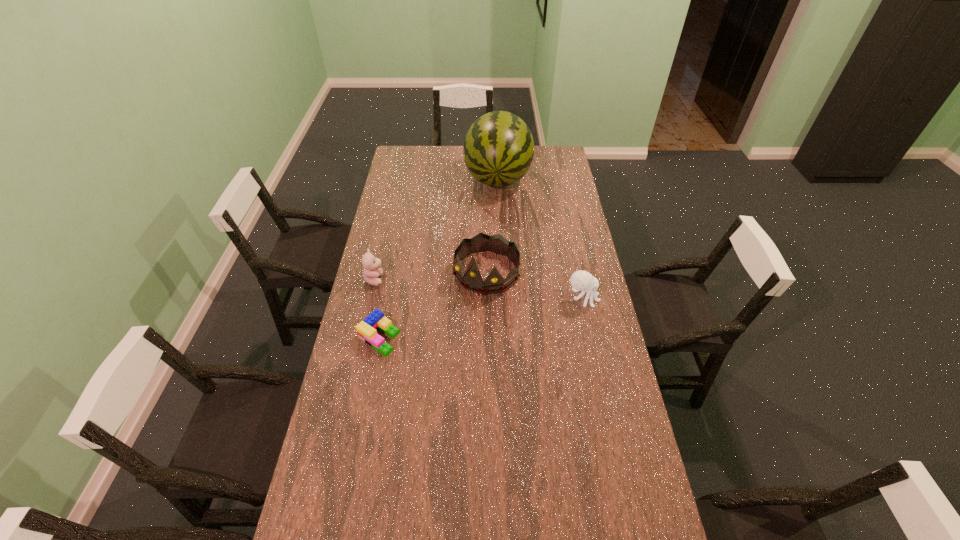
You are a GUI agent. You are given a task and a screenshot of the screen. Output one action in this format:
    pyautogui.click(x=<x>, y=<y>)
    Task: Click on the Lego
    
    Given the screenshot: What is the action you would take?
    click(367, 329)

The image size is (960, 540). I want to click on the nearest object, so click(x=367, y=329).

You are a GUI agent. You are given a task and a screenshot of the screen. Output one action in this format:
    pyautogui.click(x=<x>, y=<y>)
    Task: Click on the octopus
    This screenshot has height=540, width=960.
    Given the screenshot: What is the action you would take?
    pyautogui.click(x=583, y=281)

The image size is (960, 540). I want to click on the tallest object, so click(498, 150).

The height and width of the screenshot is (540, 960). Find the location of `the farthest object`. the farthest object is located at coordinates (498, 150).

In order to click on the second tallest object in this screenshot , I will do `click(472, 280)`.

In order to click on teddy bear in this screenshot , I will do `click(371, 272)`.

Locate an element on the screen. The width and height of the screenshot is (960, 540). vacant position located on the right of the nearest object is located at coordinates pyautogui.click(x=450, y=338).

Find the location of a particular element. Image resolution: width=960 pixels, height=540 pixels. vacant area situated 0.080m at the stem end of the farthest object is located at coordinates (494, 212).

Where is `vacant space located 0.320m at the stem end of the farthest object`? This screenshot has height=540, width=960. vacant space located 0.320m at the stem end of the farthest object is located at coordinates (491, 246).